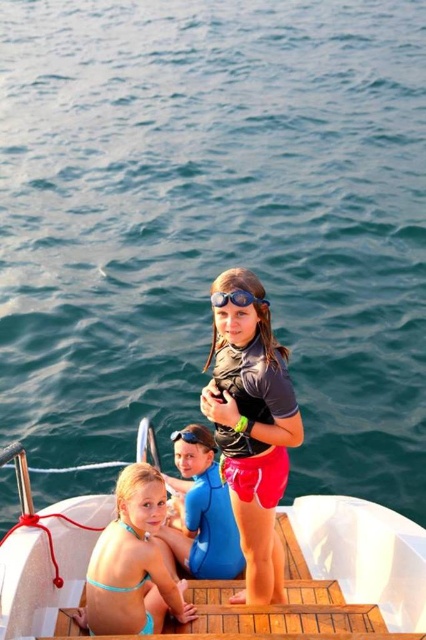
You are a lifeguard on duty and need to locate the blue rubber goggles at center and transparent blue goggles at upper center. Which of these two items is positioned higher in the image?

The blue rubber goggles at center is taller than transparent blue goggles at upper center, so the blue rubber goggles at center is positioned higher.

Consider the image. You are standing on the boat and want to move from the point at coordinates point (233, 442) to the point at coordinates point (204, 589). Which direction should you move in to get there?

You should move backward to reach point (204, 589) from point (233, 442) because point (233, 442) is in front of point (204, 589).

You are a photographer standing on the dock, and you want to take a photo of the two points on the boat. Which point, point (235,289) or point (215,442), will appear larger in the photo?

Point (235,289) will appear larger in the photo because it is closer to the viewer than point (215,442).